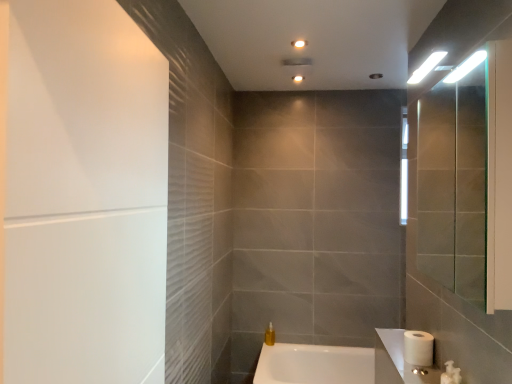
This screenshot has width=512, height=384. I want to click on unoccupied space behind matte white ceiling light at upper center, so click(292, 83).